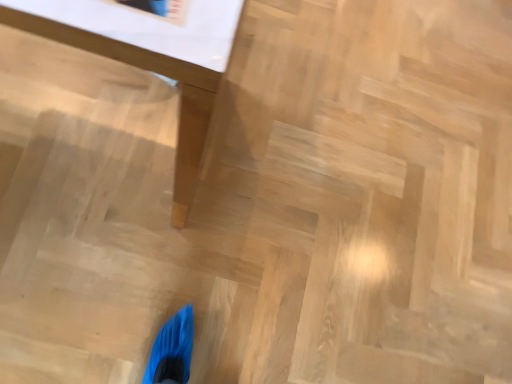
What is the approximate width of wooden table at upper left?

wooden table at upper left is 22.34 inches in width.

Image resolution: width=512 pixels, height=384 pixels. Find the location of `wooden table at upper left`. wooden table at upper left is located at coordinates (151, 71).

This screenshot has height=384, width=512. Describe the element at coordinates (151, 71) in the screenshot. I see `wooden table at upper left` at that location.

Image resolution: width=512 pixels, height=384 pixels. Find the location of `wooden table at upper left`. wooden table at upper left is located at coordinates (151, 71).